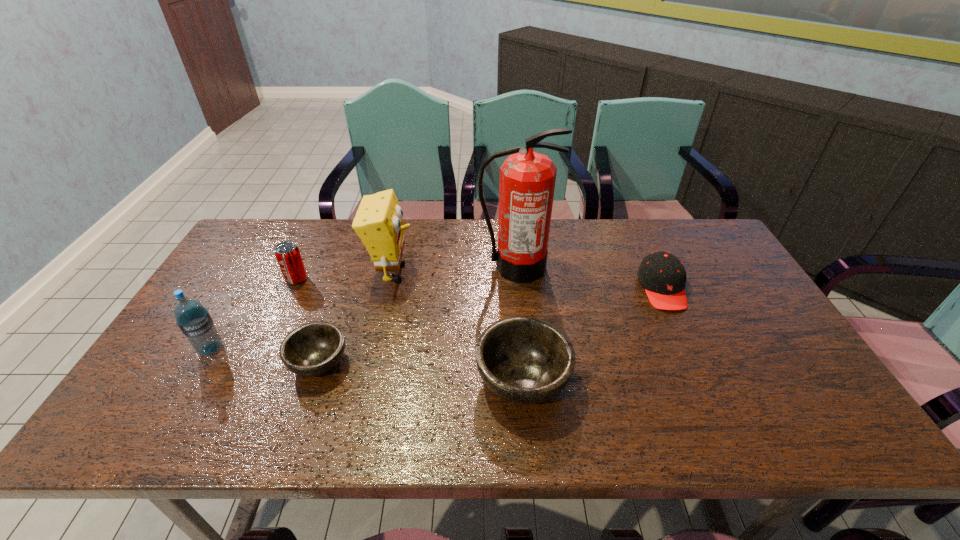
Identify the location of vacant space at the far edge of the desktop. (x=432, y=231).

Find the location of a particular element. The width and height of the screenshot is (960, 540). vacant space at the near edge is located at coordinates (383, 400).

The image size is (960, 540). In the image, there is a desktop. What are the coordinates of `vacant space at the left edge` in the screenshot? It's located at (250, 294).

Where is `free point at the far right corner`? free point at the far right corner is located at coordinates (670, 230).

Find the location of `vacant area at the near right corner of the desktop`. vacant area at the near right corner of the desktop is located at coordinates (759, 385).

Identify the location of unoccupied area between the right bowl and the rightmost object. point(592,334).

The width and height of the screenshot is (960, 540). I want to click on free spot between the taller bowl and the left bowl, so click(x=420, y=371).

Find the location of a particular element. The image size is (960, 540). free space between the soda can and the shorter bowl is located at coordinates (308, 321).

Locate an element on the screen. free space between the taller bowl and the cap is located at coordinates (592, 334).

Find the location of `free area in between the third tallest object and the rightmost object`. free area in between the third tallest object and the rightmost object is located at coordinates (437, 319).